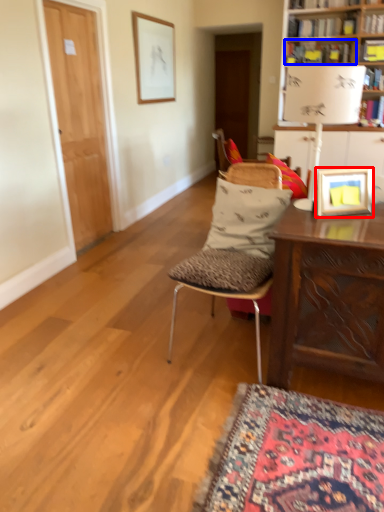
Question: Which object appears closest to the camera in this image, picture frame (highlighted by a red box) or book (highlighted by a blue box)?

Choices:
 (A) picture frame
 (B) book

Answer: (A)